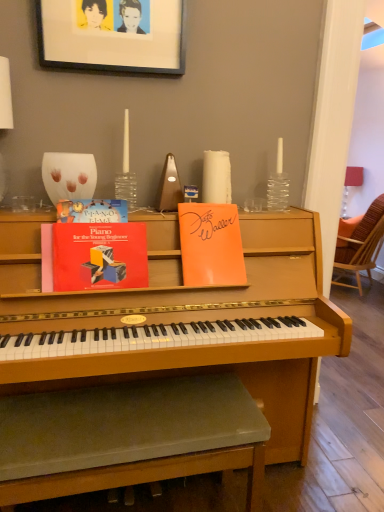
Find the location of a particular element. empty space that is ontop of green fabric music stool at lower center (from a real-world perspective) is located at coordinates (140, 403).